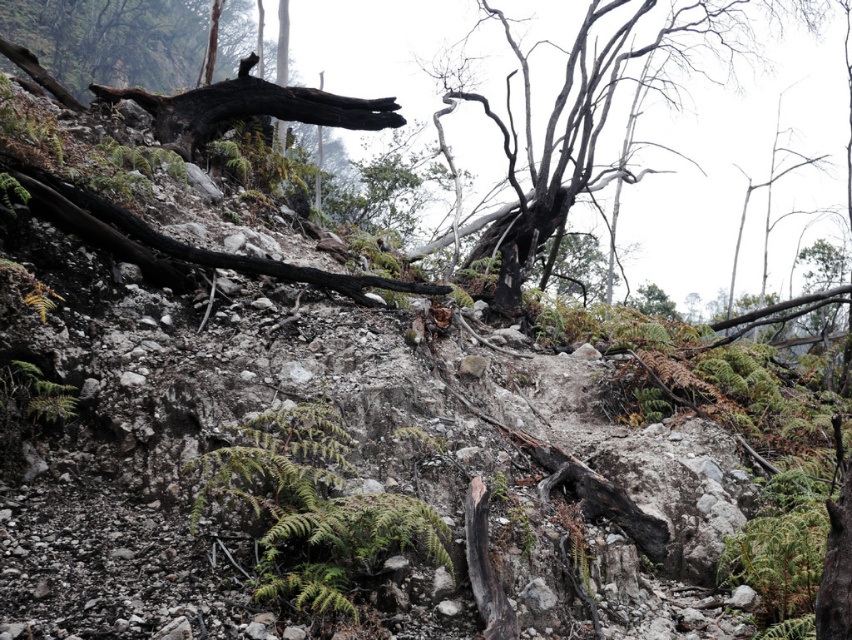
Question: Does green fuzzy fern at center appear on the right side of charcoal textured tree at center?

Choices:
 (A) yes
 (B) no

Answer: (B)

Question: Is green fuzzy fern at center closer to the viewer compared to charcoal textured tree at center?

Choices:
 (A) no
 (B) yes

Answer: (B)

Question: Does green fuzzy fern at center have a smaller size compared to charcoal textured tree at center?

Choices:
 (A) yes
 (B) no

Answer: (A)

Question: Which object is closer to the camera taking this photo?

Choices:
 (A) charcoal textured tree at center
 (B) green fuzzy fern at center

Answer: (B)